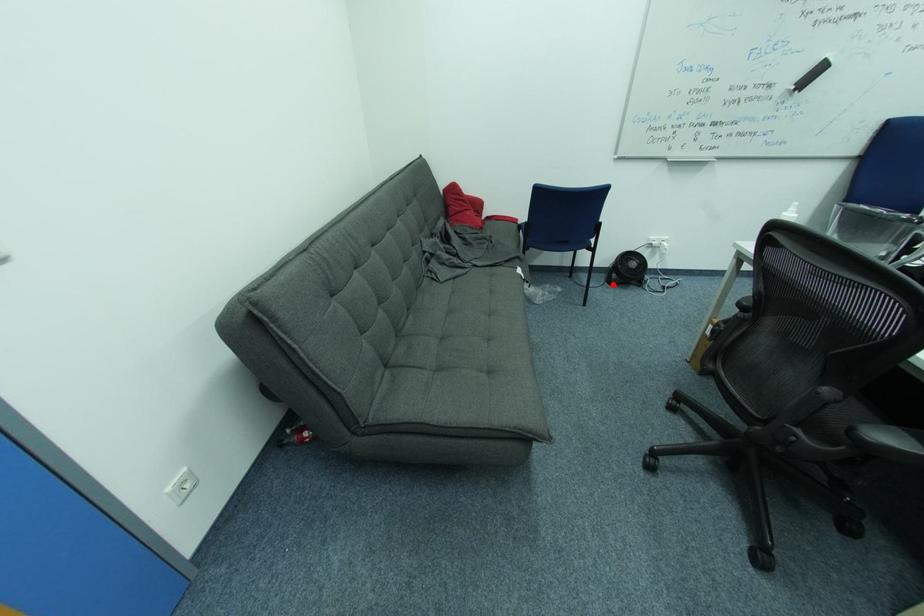
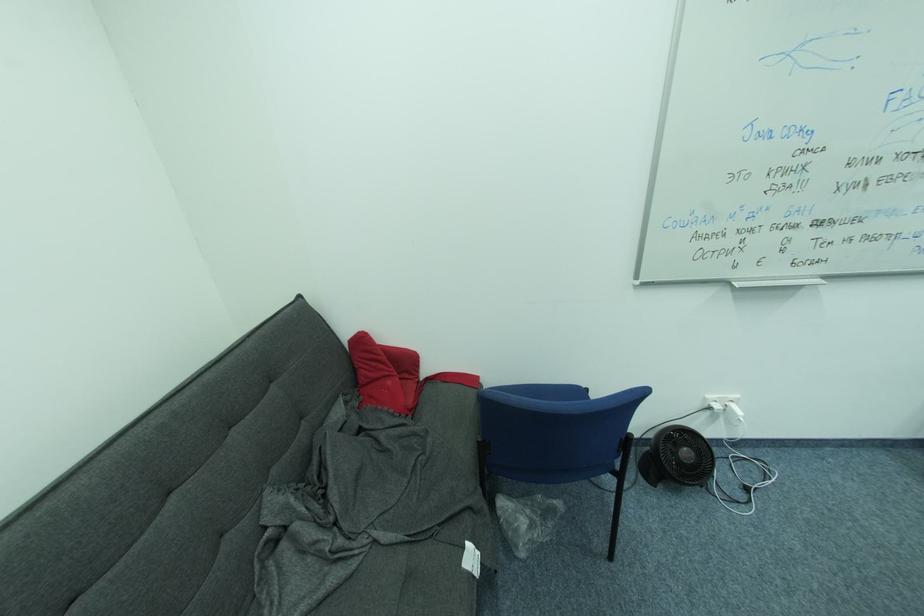
Locate, in the second image, the point that corresponds to the highlighted location in the first image.

(648, 479)